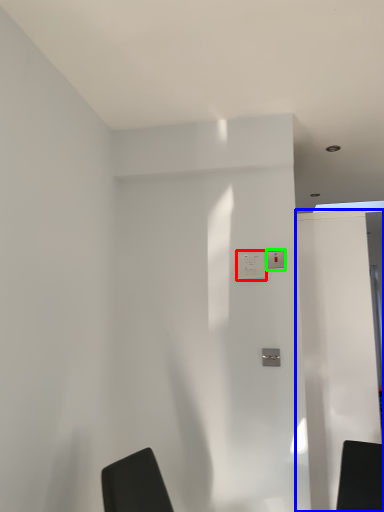
Question: Considering the real-world distances, which object is closest to electric outlet (highlighted by a red box)? screen door (highlighted by a blue box) or light switch (highlighted by a green box).

Choices:
 (A) screen door
 (B) light switch

Answer: (B)